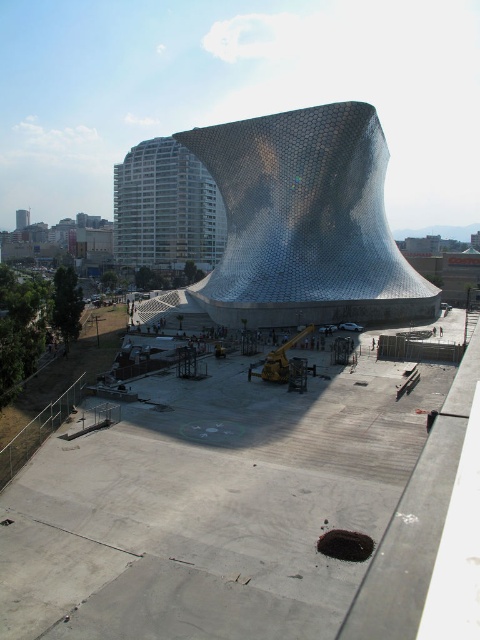
From the picture: Between white glass building at upper left and matte gray concrete bench at center, which one has more height?

white glass building at upper left is taller.

The image size is (480, 640). In order to click on white glass building at upper left in this screenshot , I will do `click(166, 209)`.

Between concrete at center and matte gray concrete bench at center, which one appears on the right side from the viewer's perspective?

concrete at center

What are the coordinates of `concrete at center` in the screenshot? It's located at (233, 508).

Where is `concrete at center`? concrete at center is located at coordinates (233, 508).

Can you confirm if metallic honeycomb structure at center is positioned to the left of matte gray concrete bench at center?

No, metallic honeycomb structure at center is not to the left of matte gray concrete bench at center.

Between metallic honeycomb structure at center and matte gray concrete bench at center, which one has more height?

metallic honeycomb structure at center

This screenshot has height=640, width=480. Describe the element at coordinates (305, 221) in the screenshot. I see `metallic honeycomb structure at center` at that location.

Where is `metallic honeycomb structure at center`? metallic honeycomb structure at center is located at coordinates (305, 221).